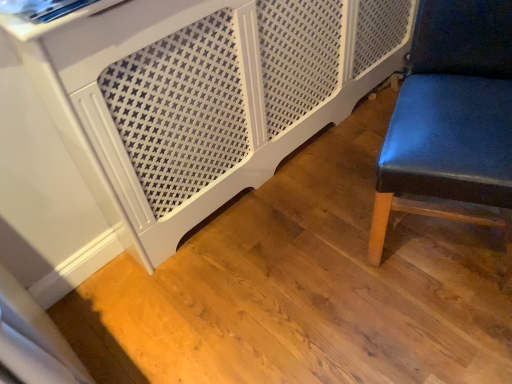
Locate an element on the screen. This screenshot has width=512, height=384. free spot below blue leather chair at right (from a real-world perspective) is located at coordinates (434, 243).